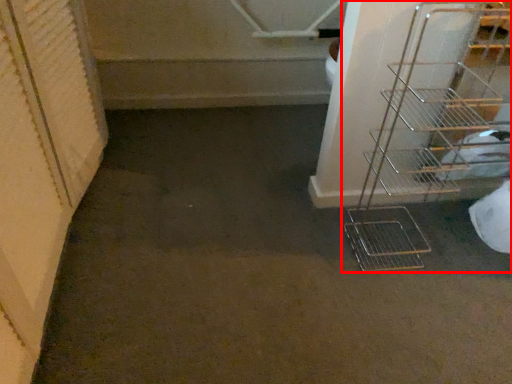
Question: Where is shelf (annotated by the red box) located in relation to stairs in the image?

Choices:
 (A) right
 (B) left

Answer: (A)